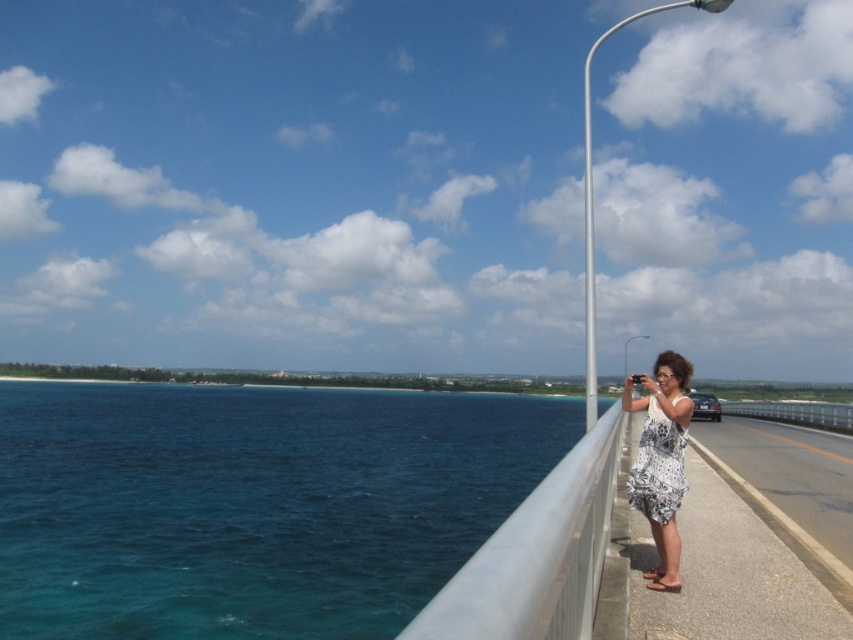
Question: Based on their relative distances, which object is nearer to the blue water at left?

Choices:
 (A) silver metallic rail at center
 (B) silver metallic pole at upper right

Answer: (B)

Question: Can you confirm if silver metallic rail at center is positioned to the left of white dotted dress at right?

Choices:
 (A) no
 (B) yes

Answer: (B)

Question: Which of the following is the farthest from the observer?

Choices:
 (A) blue water at left
 (B) silver metallic rail at center
 (C) metallic silver pole at upper center
 (D) silver metallic pole at upper right

Answer: (C)

Question: Can you confirm if white dotted dress at right is positioned to the right of silver metallic pole at upper right?

Choices:
 (A) no
 (B) yes

Answer: (A)

Question: Estimate the real-world distances between objects in this image. Which object is closer to the blue water at left?

Choices:
 (A) silver metallic pole at upper right
 (B) white dotted dress at right

Answer: (A)

Question: Is blue water at left to the left of metallic silver pole at upper center from the viewer's perspective?

Choices:
 (A) yes
 (B) no

Answer: (A)